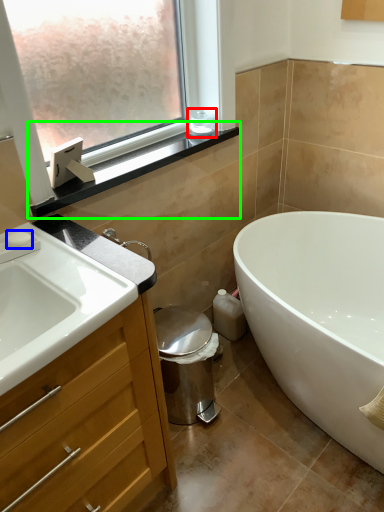
Question: Which is nearer to the toiletry (highlighted by a red box)? soap (highlighted by a blue box) or window sill (highlighted by a green box).

Choices:
 (A) soap
 (B) window sill

Answer: (B)